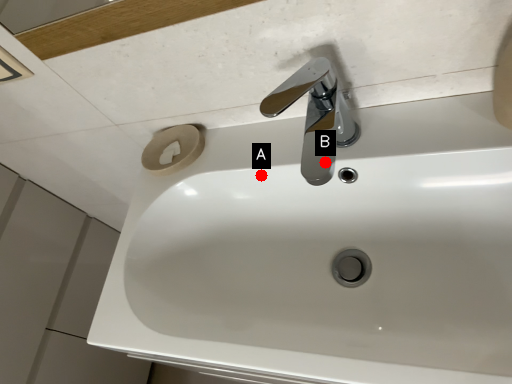
Question: Two points are circled on the image, labeled by A and B beside each circle. Among these points, which one is farthest from the camera?

Choices:
 (A) A is further
 (B) B is further

Answer: (B)